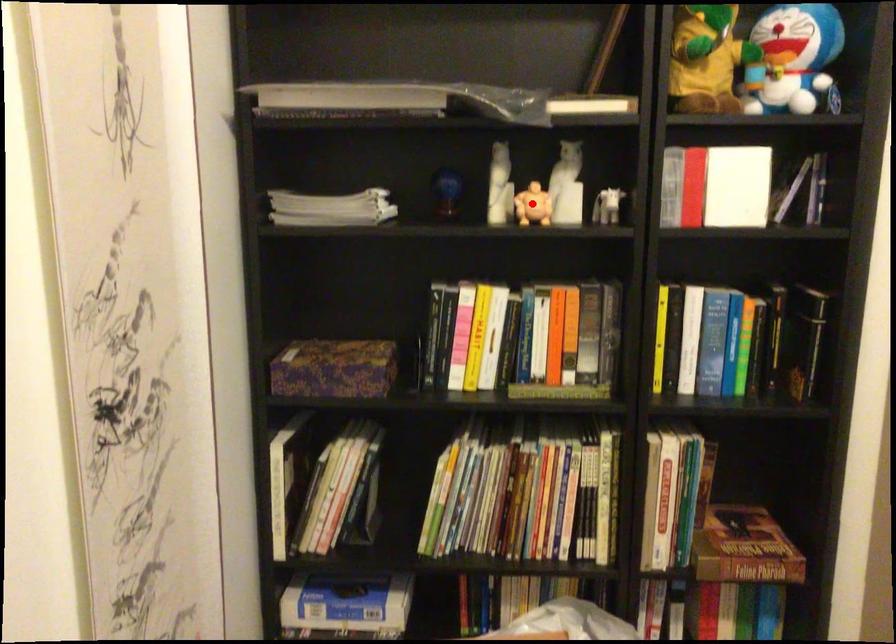
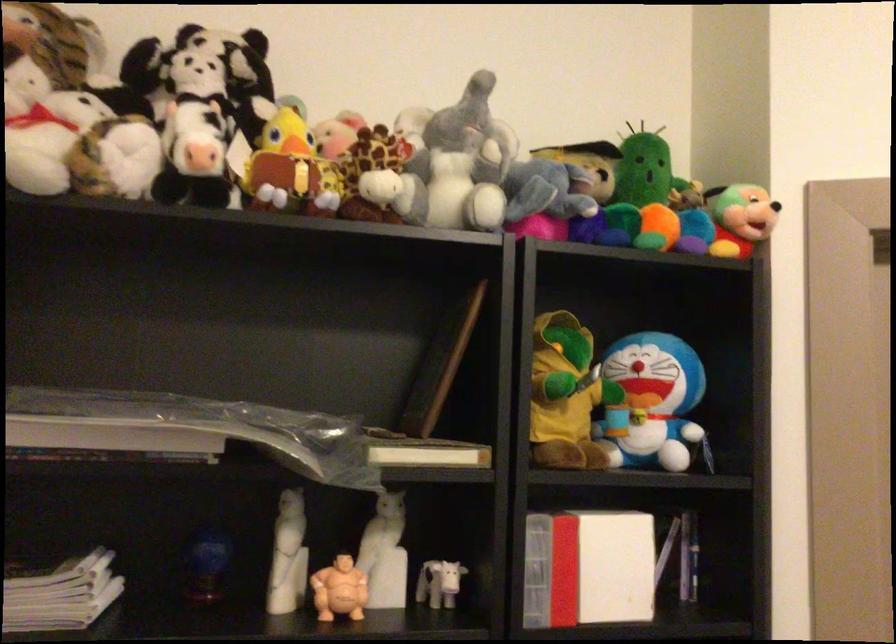
Question: I am providing you with two images of the same scene from different viewpoints. A red point is marked on the first image. Can you still see the location of the red point in image 2?

Choices:
 (A) Yes
 (B) No

Answer: (A)